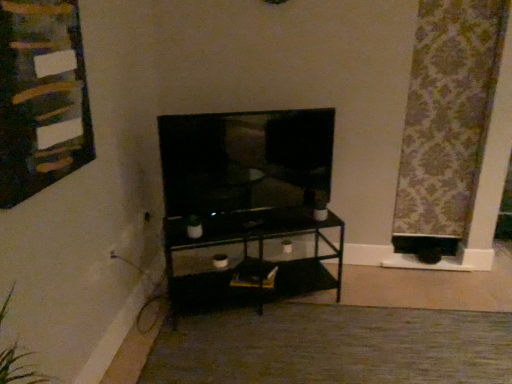
Question: Considering the relative sizes of wooden bulletin board at upper left and carpet at center in the image provided, is wooden bulletin board at upper left smaller than carpet at center?

Choices:
 (A) yes
 (B) no

Answer: (A)

Question: Is wooden bulletin board at upper left turned away from carpet at center?

Choices:
 (A) no
 (B) yes

Answer: (A)

Question: Is wooden bulletin board at upper left further to the viewer compared to carpet at center?

Choices:
 (A) yes
 (B) no

Answer: (B)

Question: Is wooden bulletin board at upper left not close to carpet at center?

Choices:
 (A) no
 (B) yes

Answer: (B)

Question: Does wooden bulletin board at upper left appear on the right side of carpet at center?

Choices:
 (A) yes
 (B) no

Answer: (B)

Question: Could you tell me if wooden bulletin board at upper left is facing carpet at center?

Choices:
 (A) yes
 (B) no

Answer: (B)

Question: Does patterned fabric curtain at right have a larger size compared to wooden bulletin board at upper left?

Choices:
 (A) yes
 (B) no

Answer: (A)

Question: Is the surface of patterned fabric curtain at right in direct contact with wooden bulletin board at upper left?

Choices:
 (A) no
 (B) yes

Answer: (A)

Question: Can you confirm if patterned fabric curtain at right is wider than wooden bulletin board at upper left?

Choices:
 (A) yes
 (B) no

Answer: (A)

Question: Is wooden bulletin board at upper left completely or partially inside patterned fabric curtain at right?

Choices:
 (A) yes
 (B) no

Answer: (B)

Question: Is patterned fabric curtain at right not near wooden bulletin board at upper left?

Choices:
 (A) yes
 (B) no

Answer: (A)

Question: From the image's perspective, is patterned fabric curtain at right under wooden bulletin board at upper left?

Choices:
 (A) yes
 (B) no

Answer: (B)

Question: Can you confirm if matte black tv at center is positioned to the left of carpet at center?

Choices:
 (A) yes
 (B) no

Answer: (A)